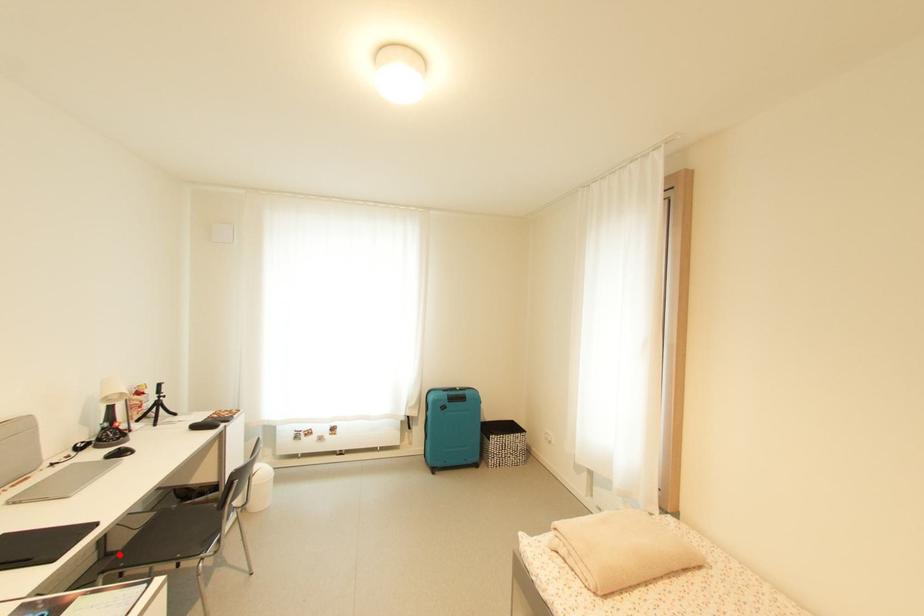
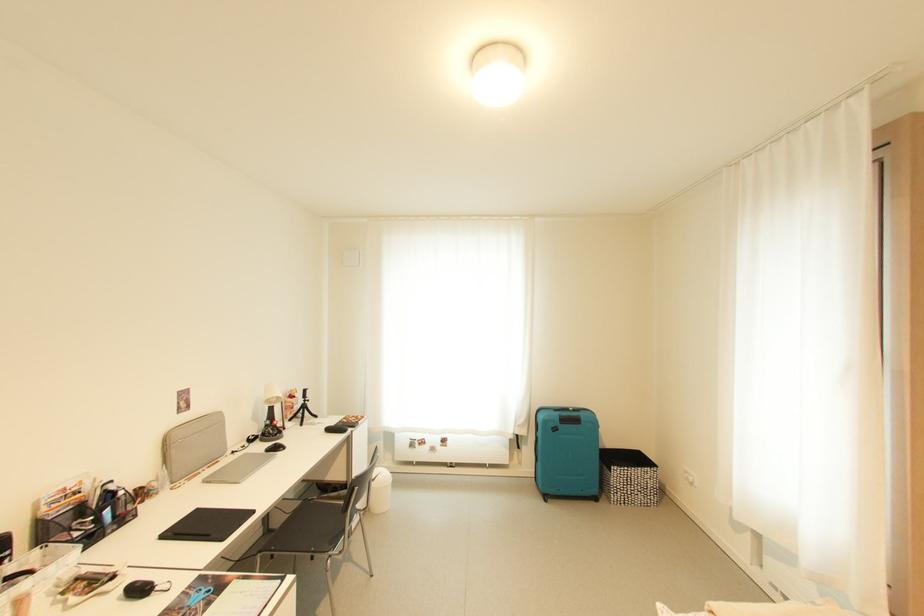
Question: I am providing you with two images of the same scene from different viewpoints. A red point is shown in image1. For the corresponding object point in image2, is it positioned nearer or farther from the camera?

Choices:
 (A) Nearer
 (B) Farther

Answer: (A)